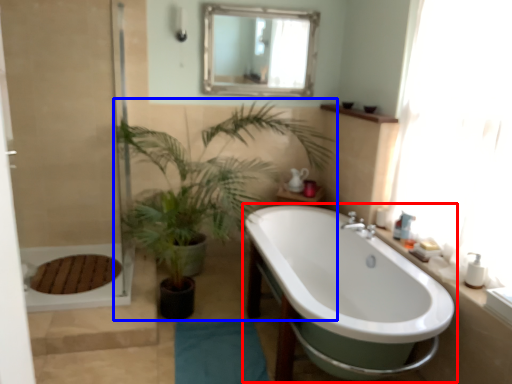
Question: Which of the following is the closest to the observer, bathtub (highlighted by a red box) or houseplant (highlighted by a blue box)?

Choices:
 (A) bathtub
 (B) houseplant

Answer: (A)